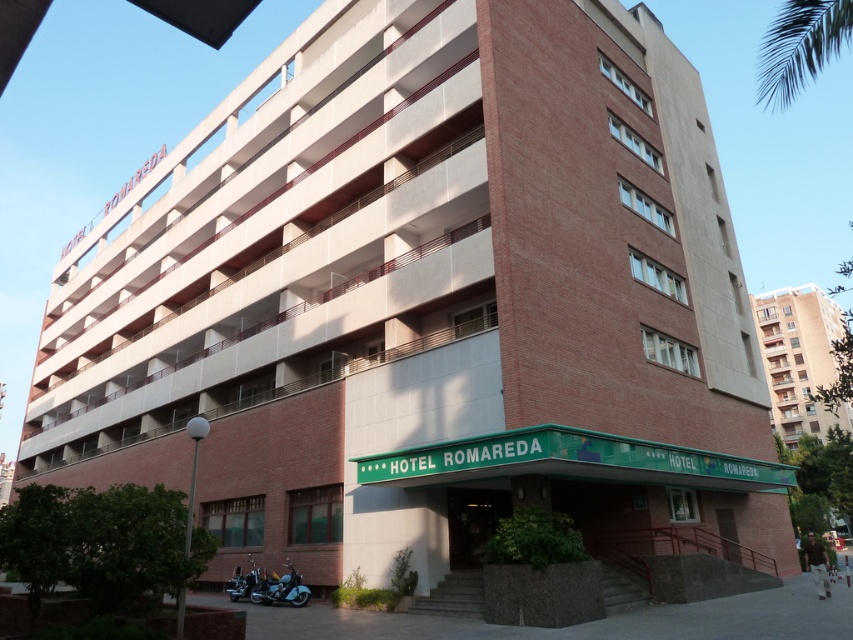
You are standing at the entrance of Hotel Romareda and notice a green leafy palm tree at upper right and a shiny chrome motorcycle at lower center. Which object is wider?

The green leafy palm tree at upper right is wider than the shiny chrome motorcycle at lower center.

You are standing in front of Hotel Romareda and want to take a photo of the entrance. There is a brown brick building at right and a green leafy palm tree at upper right. Which object should you position to the right side of your camera frame to include both the entrance and avoid blocking the palm tree?

You should position the green leafy palm tree at upper right to the right side of your camera frame. Since the brown brick building at right is to the left of the green leafy palm tree at upper right, placing the palm tree on the right ensures the building doesn

You are standing at the entrance of Hotel Romareda and want to take a photo that includes both the brown brick building at right and the green leafy palm tree at upper right. Given that your camera can capture a maximum distance of 150 feet between objects in the frame, will you be able to include both in the same photo?

The brown brick building at right and green leafy palm tree at upper right are 175.13 feet apart from each other, which exceeds the camera maximum distance of 150 feet. Therefore, you cannot include both in the same photo.